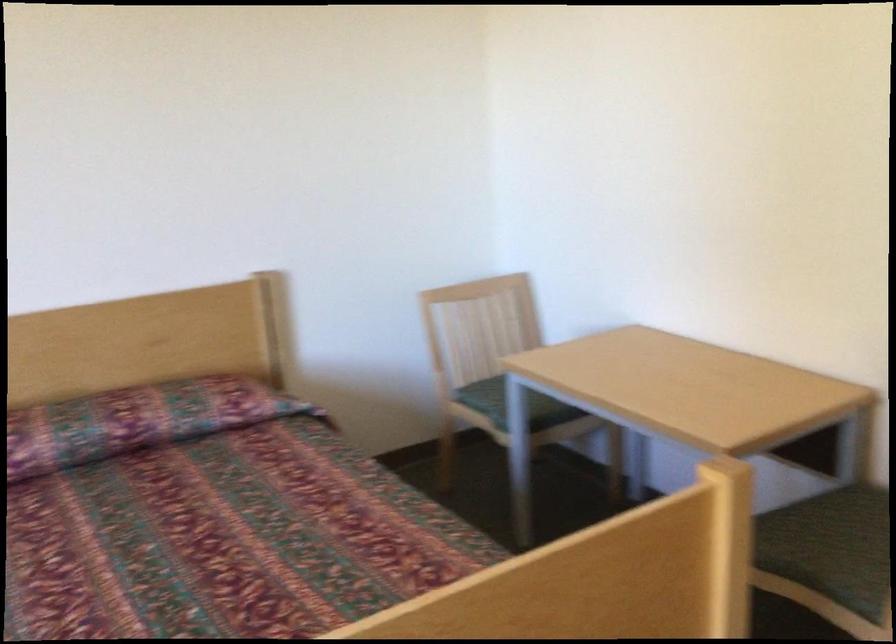
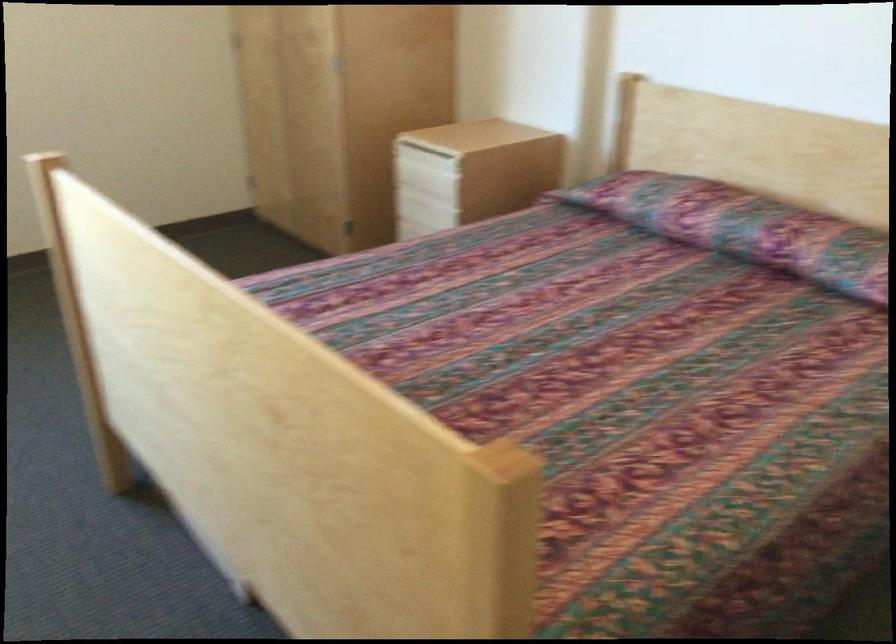
The point at (83, 435) is marked in the first image. Where is the corresponding point in the second image?

(744, 227)